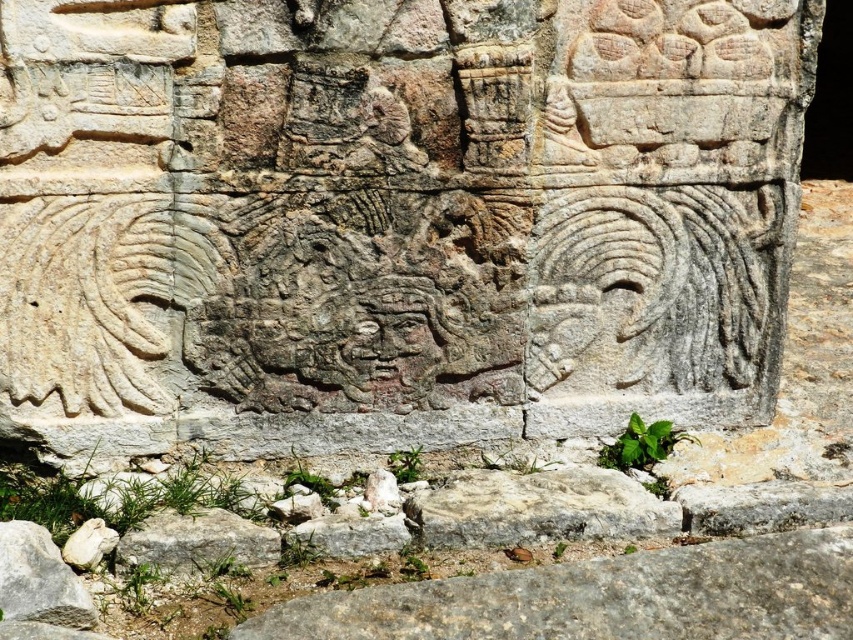
Question: Is gray rough stone at lower center below white stone at lower center?

Choices:
 (A) no
 (B) yes

Answer: (B)

Question: Is white stone at lower center to the left of gray rough stone at lower left from the viewer's perspective?

Choices:
 (A) no
 (B) yes

Answer: (A)

Question: Which object is the closest to the white stone at lower center?

Choices:
 (A) gray rough stone at lower center
 (B) gray rough stone at lower left
 (C) gray stone carving at center

Answer: (B)

Question: Which object is closer to the camera taking this photo?

Choices:
 (A) white stone at lower center
 (B) gray stone carving at center
 (C) gray rough stone at lower center
 (D) gray rough stone at lower left

Answer: (C)

Question: Which point is farther to the camera?

Choices:
 (A) gray rough stone at lower left
 (B) gray stone carving at center
 (C) white stone at lower center

Answer: (B)

Question: Is gray rough stone at lower center wider than gray rough stone at lower left?

Choices:
 (A) no
 (B) yes

Answer: (B)